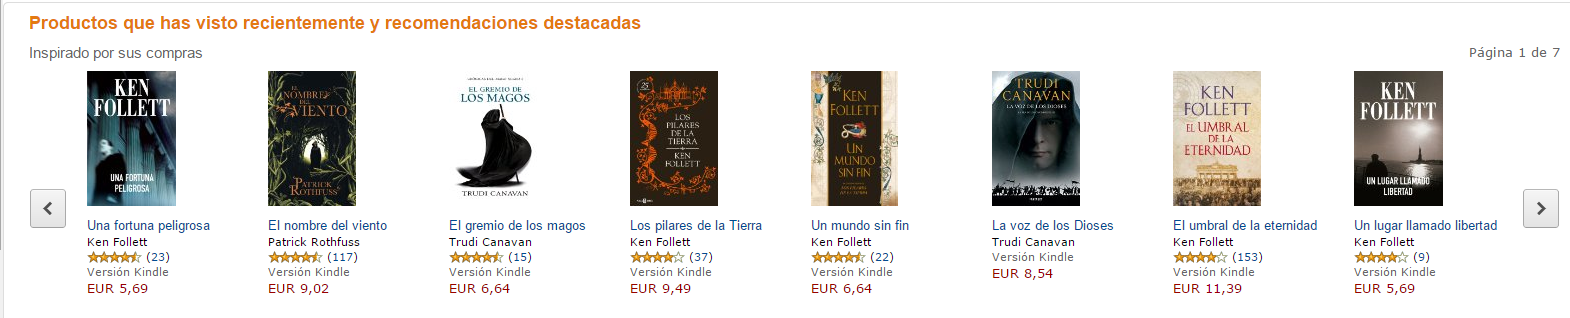
The height and width of the screenshot is (318, 1570). What are the coordinates of `books` in the screenshot? It's located at (1400, 140), (1232, 153), (1053, 153), (843, 151), (688, 141), (504, 148), (311, 145), (159, 140).